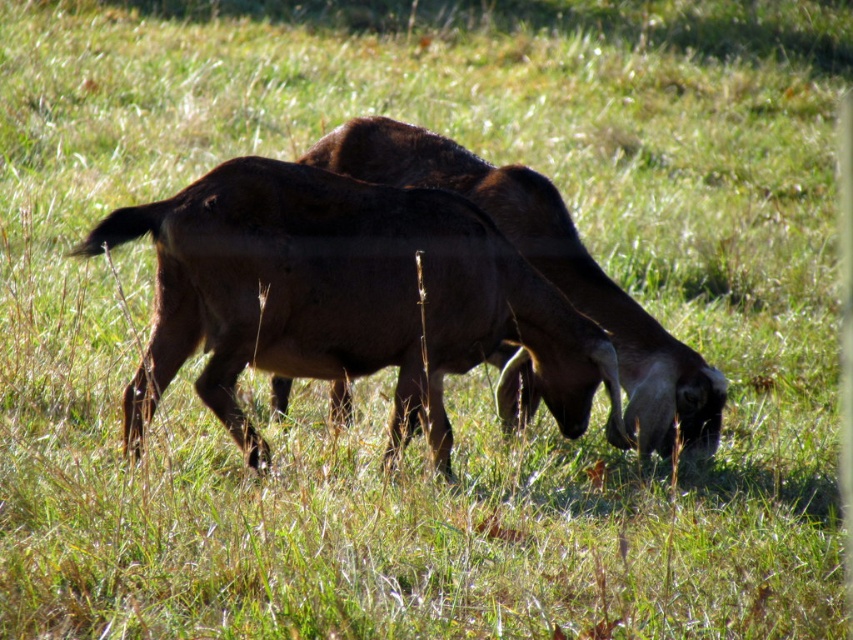
In the scene shown: Does brown rough fur goat at center appear on the left side of brown matte goat at center?

Correct, you'll find brown rough fur goat at center to the left of brown matte goat at center.

Looking at this image, between brown rough fur goat at center and brown matte goat at center, which one is positioned higher?

brown matte goat at center

Between point (184, 243) and point (613, 305), which one is positioned behind?

The point (613, 305) is behind.

You are a GUI agent. You are given a task and a screenshot of the screen. Output one action in this format:
    pyautogui.click(x=<x>, y=<y>)
    Task: Click on the brown rough fur goat at center
    
    Given the screenshot: What is the action you would take?
    pyautogui.click(x=346, y=298)